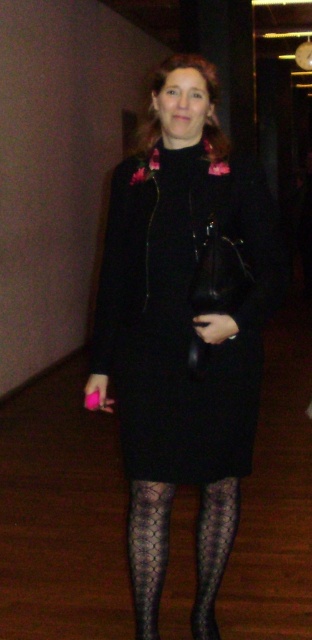
Question: Which object is closer to the camera taking this photo?

Choices:
 (A) black mesh tights at center
 (B) black matte dress at center

Answer: (B)

Question: Is black matte dress at center thinner than black mesh tights at center?

Choices:
 (A) yes
 (B) no

Answer: (B)

Question: Which point is closer to the camera taking this photo?

Choices:
 (A) (201, 504)
 (B) (218, 480)

Answer: (B)

Question: Among these points, which one is nearest to the camera?

Choices:
 (A) (198, 572)
 (B) (162, 333)

Answer: (B)

Question: Can you confirm if black matte dress at center is thinner than black mesh tights at center?

Choices:
 (A) yes
 (B) no

Answer: (B)

Question: Is black matte dress at center thinner than black mesh tights at center?

Choices:
 (A) yes
 (B) no

Answer: (B)